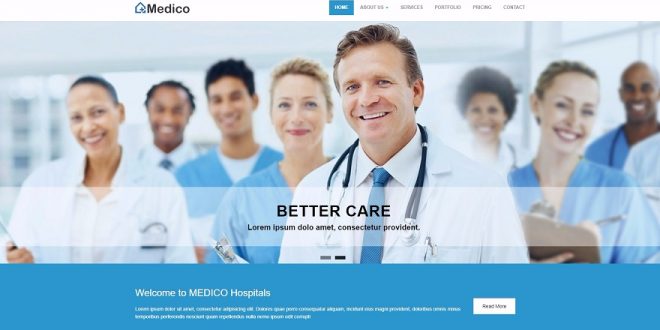
Where is `clipboard`? The height and width of the screenshot is (330, 660). clipboard is located at coordinates (566, 245), (226, 250), (7, 233).